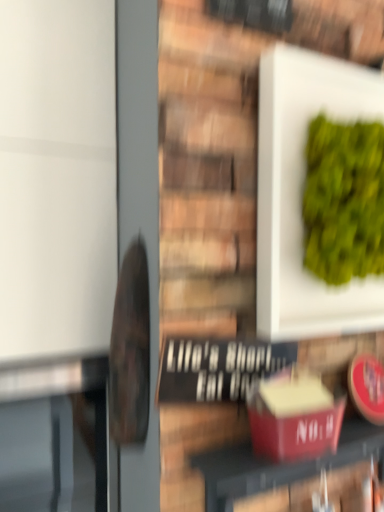
What is the approximate width of matte red box at center?

It is 5.12 inches.

Locate an element on the screen. Image resolution: width=384 pixels, height=512 pixels. matte red box at center is located at coordinates (281, 465).

The height and width of the screenshot is (512, 384). What do you see at coordinates (281, 465) in the screenshot?
I see `matte red box at center` at bounding box center [281, 465].

Measure the distance between matte red box at center and camera.

A distance of 27.45 inches exists between matte red box at center and camera.

The height and width of the screenshot is (512, 384). What are the coordinates of `white matte plate at upper right` in the screenshot? It's located at (x=302, y=194).

Measure the distance between point (380, 75) and camera.

Point (380, 75) is 36.89 inches from camera.

What do you see at coordinates (302, 194) in the screenshot? The width and height of the screenshot is (384, 512). I see `white matte plate at upper right` at bounding box center [302, 194].

I want to click on matte red box at center, so click(x=281, y=465).

Between white matte plate at upper right and matte red box at center, which one appears on the right side from the viewer's perspective?

white matte plate at upper right.

Which object is further away from the camera taking this photo, white matte plate at upper right or matte red box at center?

Positioned behind is white matte plate at upper right.

Is point (266, 283) less distant than point (283, 481)?

Yes.

From the image's perspective, is white matte plate at upper right under matte red box at center?

No.

From a real-world perspective, is white matte plate at upper right positioned under matte red box at center based on gravity?

Incorrect, from a real-world perspective, white matte plate at upper right is higher than matte red box at center.

Between white matte plate at upper right and matte red box at center, which one has larger width?

Wider between the two is white matte plate at upper right.

Is white matte plate at upper right taller or shorter than matte red box at center?

Clearly, white matte plate at upper right is taller compared to matte red box at center.

Looking at the image, does white matte plate at upper right seem bigger or smaller compared to matte red box at center?

Considering their sizes, white matte plate at upper right takes up more space than matte red box at center.

Consider the image. Would you say white matte plate at upper right is inside or outside matte red box at center?

The correct answer is: outside.

Is white matte plate at upper right not near matte red box at center?

They are positioned close to each other.

Is white matte plate at upper right facing towards matte red box at center?

No, white matte plate at upper right is not facing towards matte red box at center.

Identify the location of square on the right of matte red box at center. [x=302, y=194].

Can you confirm if matte red box at center is positioned to the left of white matte plate at upper right?

Correct, you'll find matte red box at center to the left of white matte plate at upper right.

Is matte red box at center in front of or behind white matte plate at upper right in the image?

Visually, matte red box at center is located in front of white matte plate at upper right.

Which is closer to the camera, (380, 435) or (300, 226)?

Point (380, 435).

From the image's perspective, is matte red box at center above white matte plate at upper right?

No, from the image's perspective, matte red box at center is not on top of white matte plate at upper right.

From a real-world perspective, is matte red box at center over white matte plate at upper right?

No, from a real-world perspective, matte red box at center is not over white matte plate at upper right

Looking at their sizes, would you say matte red box at center is wider or thinner than white matte plate at upper right?

Considering their sizes, matte red box at center looks slimmer than white matte plate at upper right.

Considering the relative sizes of matte red box at center and white matte plate at upper right in the image provided, is matte red box at center shorter than white matte plate at upper right?

Indeed, matte red box at center has a lesser height compared to white matte plate at upper right.

Is matte red box at center bigger than white matte plate at upper right?

Actually, matte red box at center might be smaller than white matte plate at upper right.

Is matte red box at center surrounding white matte plate at upper right?

No, white matte plate at upper right is not a part of matte red box at center.

Can you see matte red box at center touching white matte plate at upper right?

No, matte red box at center is not making contact with white matte plate at upper right.

Is matte red box at center oriented away from white matte plate at upper right?

No, matte red box at center's orientation is not away from white matte plate at upper right.

I want to click on furniture on the left of white matte plate at upper right, so click(281, 465).

You are a GUI agent. You are given a task and a screenshot of the screen. Output one action in this format:
    pyautogui.click(x=<x>, y=<y>)
    Task: Click on the square behind the matte red box at center
    
    Given the screenshot: What is the action you would take?
    pyautogui.click(x=302, y=194)

Where is `furniture below the white matte plate at upper right (from a real-world perspective)`? The image size is (384, 512). furniture below the white matte plate at upper right (from a real-world perspective) is located at coordinates (281, 465).